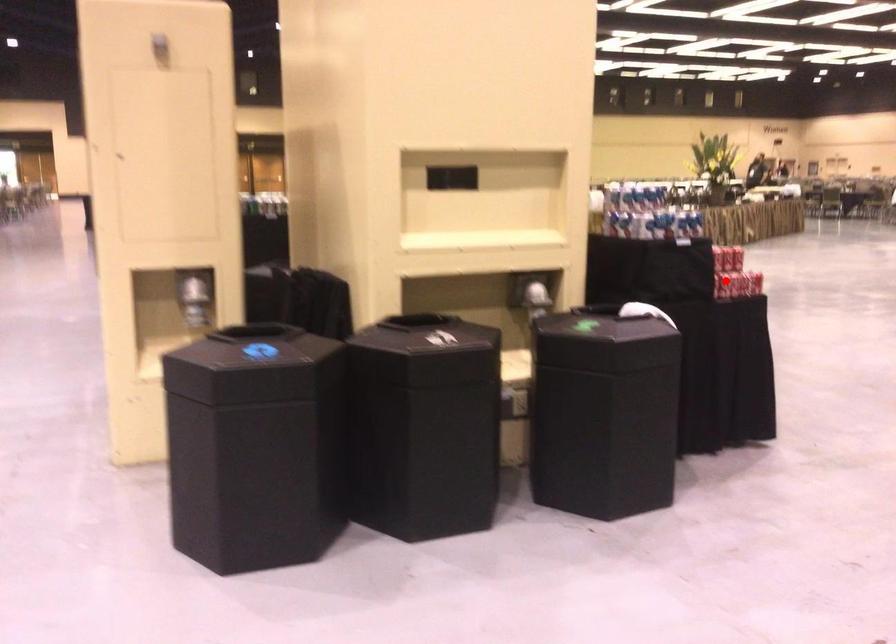
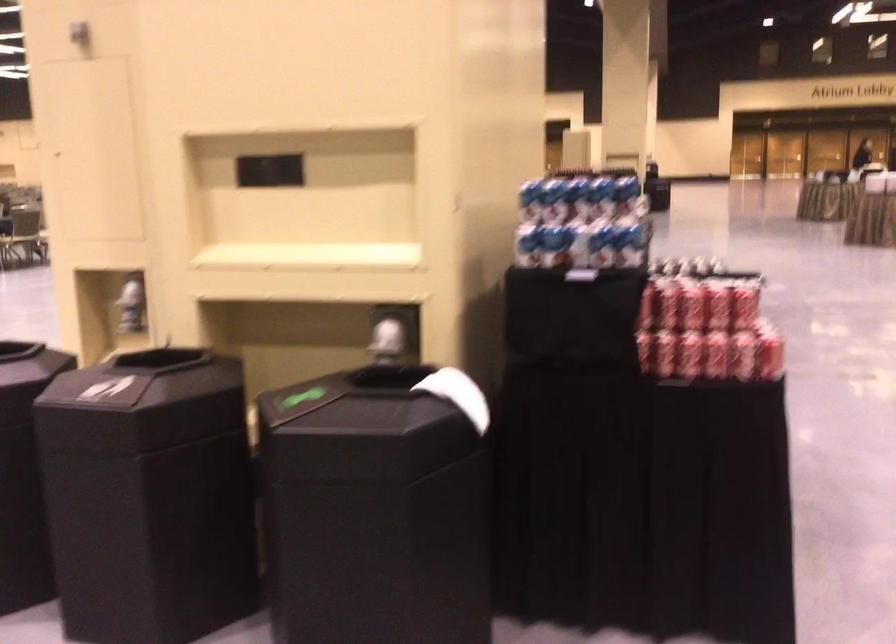
Question: I am providing you with two images of the same scene from different viewpoints. Given a red point in image1, look at the same physical point in image2. Is it:

Choices:
 (A) Closer to the viewpoint
 (B) Farther from the viewpoint

Answer: (A)